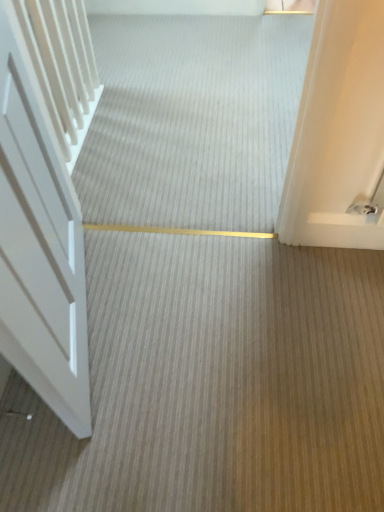
Question: Is the position of smooth beige carpet at center more distant than that of white matte door at left?

Choices:
 (A) no
 (B) yes

Answer: (B)

Question: Is smooth beige carpet at center smaller than white matte door at left?

Choices:
 (A) yes
 (B) no

Answer: (A)

Question: Is smooth beige carpet at center shorter than white matte door at left?

Choices:
 (A) no
 (B) yes

Answer: (B)

Question: From a real-world perspective, is smooth beige carpet at center physically below white matte door at left?

Choices:
 (A) yes
 (B) no

Answer: (A)

Question: Does smooth beige carpet at center have a larger size compared to white matte door at left?

Choices:
 (A) yes
 (B) no

Answer: (B)

Question: Considering the relative positions of smooth beige carpet at center and white matte door at left in the image provided, is smooth beige carpet at center in front of white matte door at left?

Choices:
 (A) no
 (B) yes

Answer: (A)

Question: Does white matte door at left appear on the right side of smooth beige carpet at center?

Choices:
 (A) yes
 (B) no

Answer: (B)

Question: Is white matte door at left taller than smooth beige carpet at center?

Choices:
 (A) yes
 (B) no

Answer: (A)

Question: Could you tell me if white matte door at left is facing smooth beige carpet at center?

Choices:
 (A) yes
 (B) no

Answer: (B)

Question: Considering the relative sizes of white matte door at left and smooth beige carpet at center in the image provided, is white matte door at left thinner than smooth beige carpet at center?

Choices:
 (A) yes
 (B) no

Answer: (A)

Question: Can you confirm if white matte door at left is positioned to the left of smooth beige carpet at center?

Choices:
 (A) yes
 (B) no

Answer: (A)

Question: Does white matte door at left have a larger size compared to smooth beige carpet at center?

Choices:
 (A) yes
 (B) no

Answer: (A)

Question: Choose the correct answer: Is smooth beige carpet at center inside white matte door at left or outside it?

Choices:
 (A) inside
 (B) outside

Answer: (B)